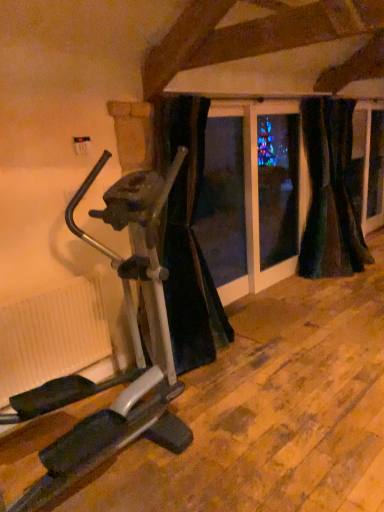
You are a GUI agent. You are given a task and a screenshot of the screen. Output one action in this format:
    pyautogui.click(x=<x>, y=<y>)
    Task: Click on the empty space that is ontop of white ribbed radiator at lower left
    
    Given the screenshot: What is the action you would take?
    pyautogui.click(x=39, y=284)